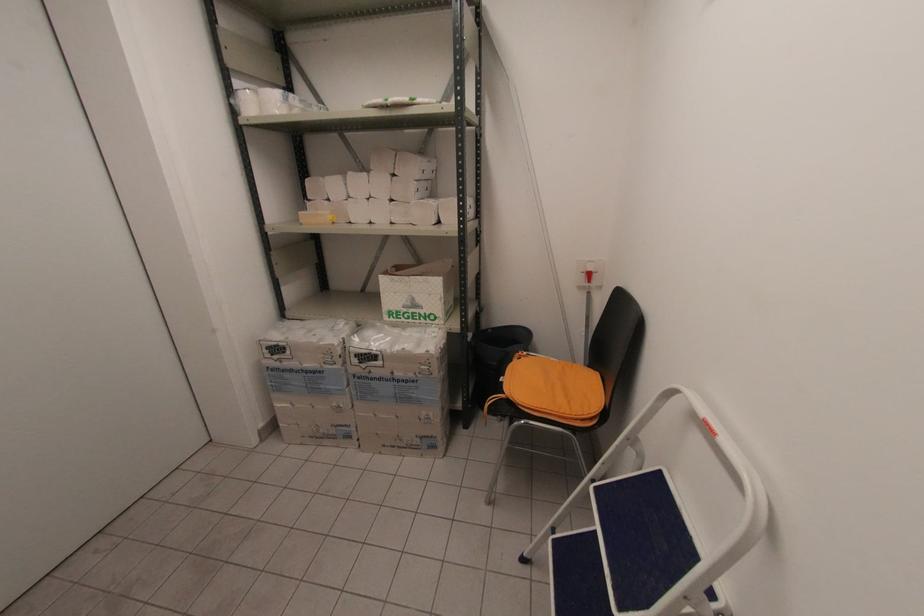
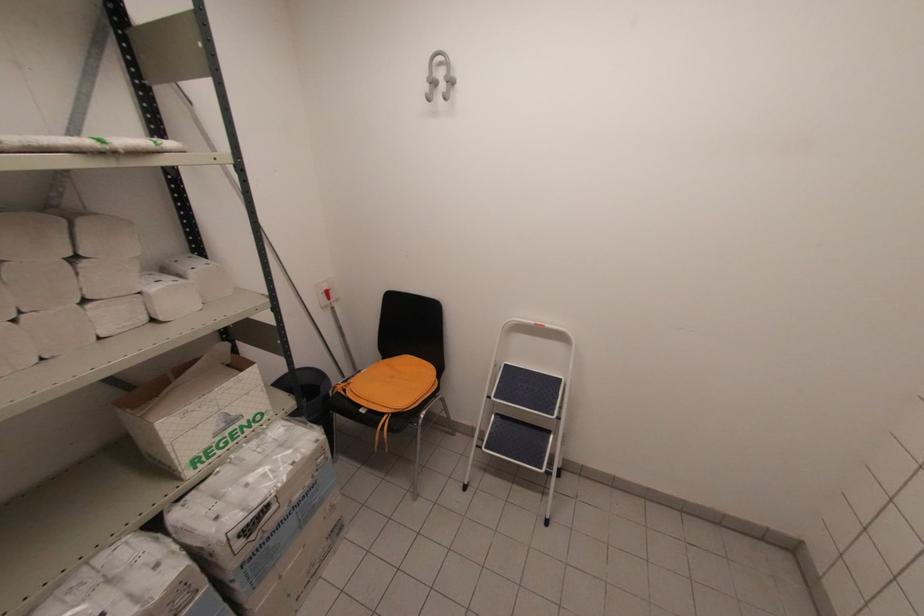
Where in the second image is the point corresponding to point (661, 472) from the first image?

(506, 366)